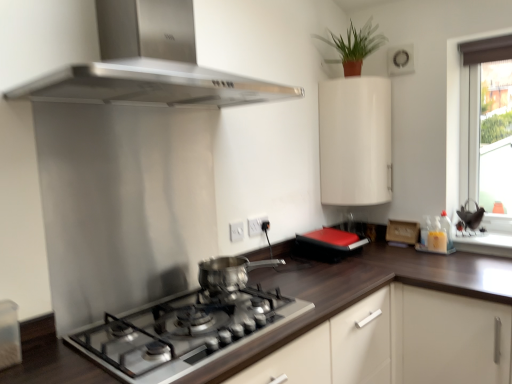
Question: Is dark wood countertop at center at the right side of green matte plant at upper right?

Choices:
 (A) no
 (B) yes

Answer: (A)

Question: Is dark wood countertop at center to the left of green matte plant at upper right from the viewer's perspective?

Choices:
 (A) yes
 (B) no

Answer: (A)

Question: From a real-world perspective, does dark wood countertop at center sit lower than green matte plant at upper right?

Choices:
 (A) yes
 (B) no

Answer: (A)

Question: Is dark wood countertop at center completely or partially outside of green matte plant at upper right?

Choices:
 (A) yes
 (B) no

Answer: (A)

Question: From a real-world perspective, is dark wood countertop at center positioned over green matte plant at upper right based on gravity?

Choices:
 (A) no
 (B) yes

Answer: (A)

Question: Relative to polished silver pot at center, is green matte plant at upper right in front or behind?

Choices:
 (A) behind
 (B) front

Answer: (A)

Question: From the image's perspective, is green matte plant at upper right above or below polished silver pot at center?

Choices:
 (A) above
 (B) below

Answer: (A)

Question: Considering the positions of green matte plant at upper right and polished silver pot at center in the image, is green matte plant at upper right bigger or smaller than polished silver pot at center?

Choices:
 (A) small
 (B) big

Answer: (B)

Question: Considering the positions of green matte plant at upper right and polished silver pot at center in the image, is green matte plant at upper right wider or thinner than polished silver pot at center?

Choices:
 (A) thin
 (B) wide

Answer: (A)

Question: In the image, is stainless steel range hood at upper center positioned in front of or behind dark wood countertop at center?

Choices:
 (A) behind
 (B) front

Answer: (A)

Question: Do you think stainless steel range hood at upper center is within dark wood countertop at center, or outside of it?

Choices:
 (A) inside
 (B) outside

Answer: (B)

Question: Looking at their shapes, would you say stainless steel range hood at upper center is wider or thinner than dark wood countertop at center?

Choices:
 (A) wide
 (B) thin

Answer: (B)

Question: Does point (180, 84) appear closer or farther from the camera than point (108, 374)?

Choices:
 (A) closer
 (B) farther

Answer: (B)

Question: In the image, is green matte plant at upper right on the left side or the right side of dark wood countertop at center?

Choices:
 (A) left
 (B) right

Answer: (B)

Question: From a real-world perspective, relative to dark wood countertop at center, is green matte plant at upper right vertically above or below?

Choices:
 (A) above
 (B) below

Answer: (A)